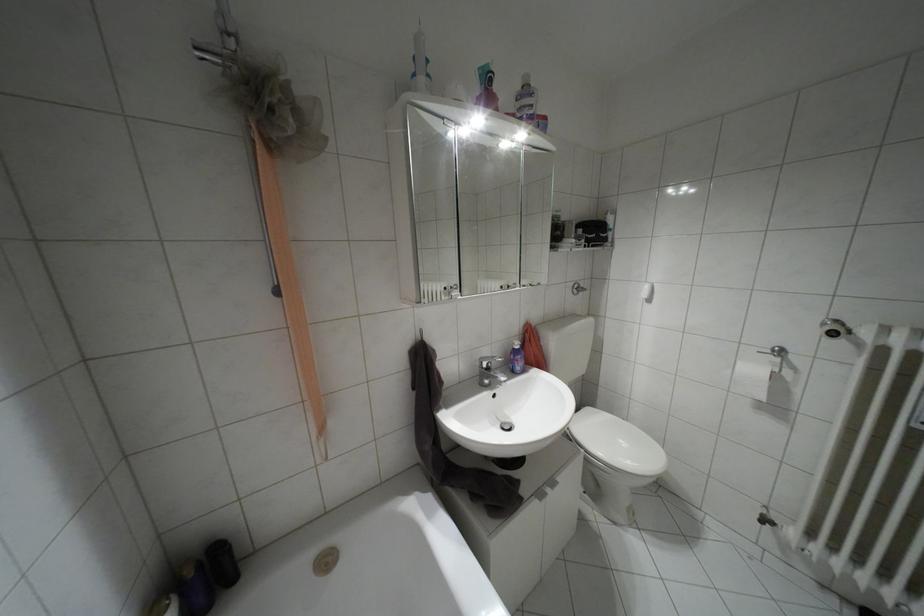
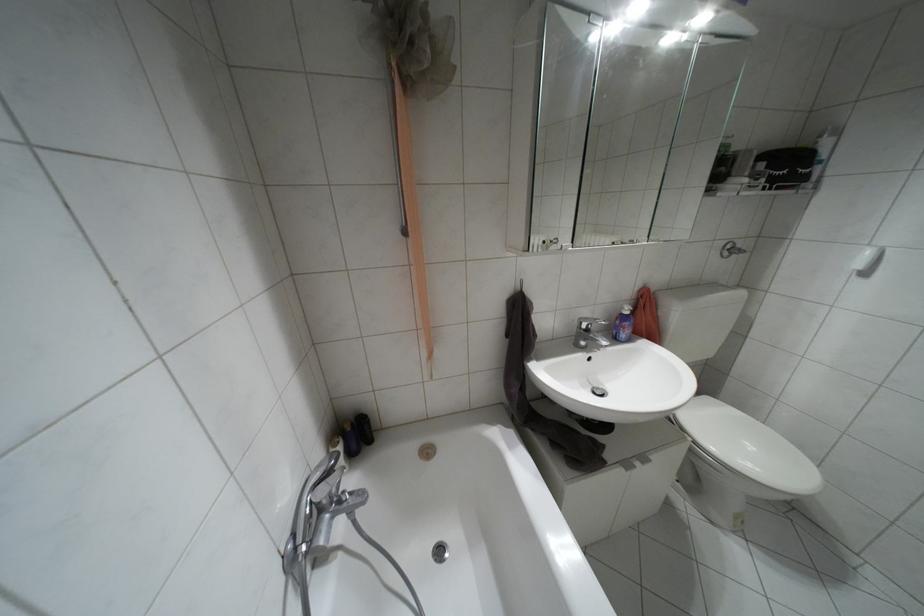
Where in the second image is the point corresponding to point (198, 562) from the first image?

(351, 424)